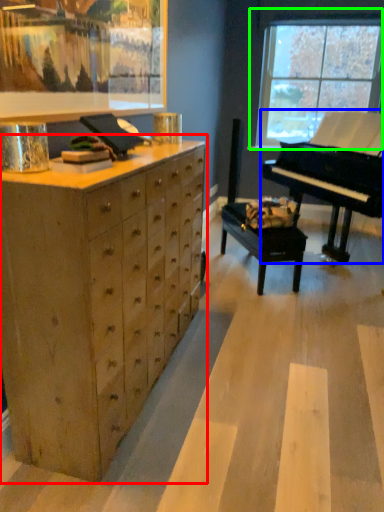
Question: Estimate the real-world distances between objects in this image. Which object is closer to chest of drawers (highlighted by a red box), piano (highlighted by a blue box) or window (highlighted by a green box)?

Choices:
 (A) piano
 (B) window

Answer: (A)